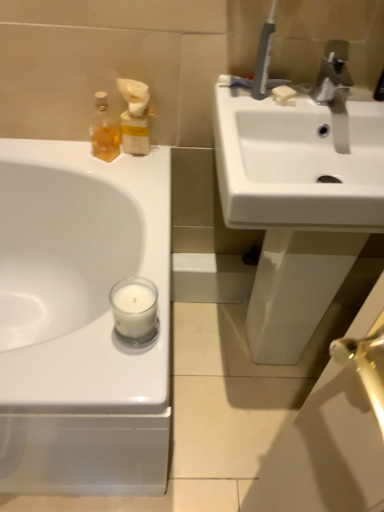
Image resolution: width=384 pixels, height=512 pixels. Find the location of `vacant position to the left of silver metallic faucet at upper right`. vacant position to the left of silver metallic faucet at upper right is located at coordinates (276, 100).